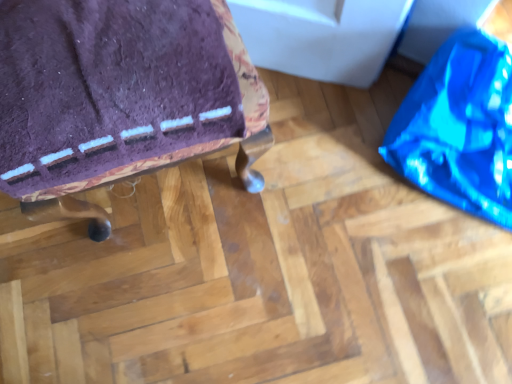
Question: Is shiny blue bean bag at right positioned far away from purple fabric cushion at upper left?

Choices:
 (A) no
 (B) yes

Answer: (A)

Question: Are shiny blue bean bag at right and purple fabric cushion at upper left beside each other?

Choices:
 (A) no
 (B) yes

Answer: (A)

Question: Is shiny blue bean bag at right facing towards purple fabric cushion at upper left?

Choices:
 (A) no
 (B) yes

Answer: (A)

Question: From the image's perspective, is shiny blue bean bag at right above purple fabric cushion at upper left?

Choices:
 (A) yes
 (B) no

Answer: (A)

Question: Considering the relative sizes of shiny blue bean bag at right and purple fabric cushion at upper left in the image provided, is shiny blue bean bag at right shorter than purple fabric cushion at upper left?

Choices:
 (A) yes
 (B) no

Answer: (A)

Question: Is shiny blue bean bag at right further to camera compared to purple fabric cushion at upper left?

Choices:
 (A) no
 (B) yes

Answer: (B)

Question: Can you confirm if purple fabric cushion at upper left is wider than shiny blue bean bag at right?

Choices:
 (A) yes
 (B) no

Answer: (B)

Question: Is purple fabric cushion at upper left next to shiny blue bean bag at right and touching it?

Choices:
 (A) no
 (B) yes

Answer: (A)

Question: Is purple fabric cushion at upper left not near shiny blue bean bag at right?

Choices:
 (A) yes
 (B) no

Answer: (B)

Question: Is purple fabric cushion at upper left smaller than shiny blue bean bag at right?

Choices:
 (A) no
 (B) yes

Answer: (A)

Question: Considering the relative sizes of purple fabric cushion at upper left and shiny blue bean bag at right in the image provided, is purple fabric cushion at upper left shorter than shiny blue bean bag at right?

Choices:
 (A) no
 (B) yes

Answer: (A)

Question: From a real-world perspective, is purple fabric cushion at upper left under shiny blue bean bag at right?

Choices:
 (A) yes
 (B) no

Answer: (B)

Question: Is point (167, 94) positioned closer to the camera than point (473, 162)?

Choices:
 (A) farther
 (B) closer

Answer: (B)